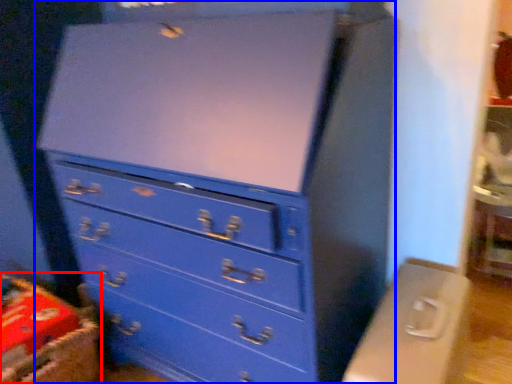
Question: Among these objects, which one is nearest to the camera, crate (highlighted by a red box) or chest of drawers (highlighted by a blue box)?

Choices:
 (A) crate
 (B) chest of drawers

Answer: (B)